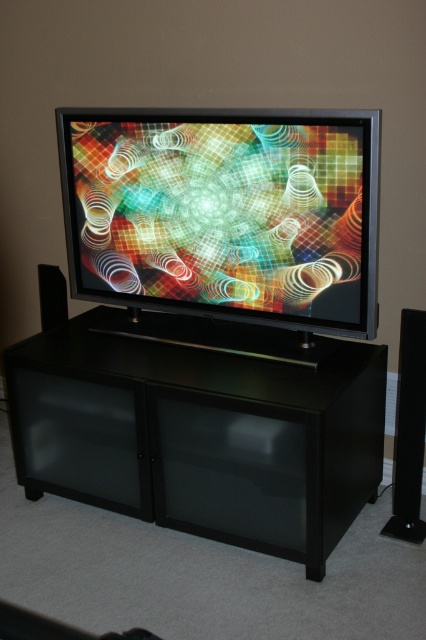
Is matte black flat screen tv at center wider than black plastic speaker at right?

Yes, matte black flat screen tv at center is wider than black plastic speaker at right.

From the picture: Does matte black flat screen tv at center have a lesser width compared to black plastic speaker at right?

Incorrect, matte black flat screen tv at center's width is not less than black plastic speaker at right's.

Where is `matte black flat screen tv at center`? Image resolution: width=426 pixels, height=640 pixels. matte black flat screen tv at center is located at coordinates (224, 212).

Is point (328, 451) less distant than point (120, 296)?

Yes, it is in front of point (120, 296).

Find the location of `black matte entertainment center at center`. black matte entertainment center at center is located at coordinates (201, 435).

Is point (75, 339) positioned behind point (307, 301)?

Yes, it is behind point (307, 301).

I want to click on black matte entertainment center at center, so click(201, 435).

Which is more to the right, black matte entertainment center at center or black matte speaker at left?

From the viewer's perspective, black matte entertainment center at center appears more on the right side.

Does black matte entertainment center at center lie behind black matte speaker at left?

That is False.

Between point (6, 365) and point (62, 282), which one is positioned in front?

Positioned in front is point (6, 365).

Find the location of a particular element. The height and width of the screenshot is (640, 426). black matte entertainment center at center is located at coordinates coord(201,435).